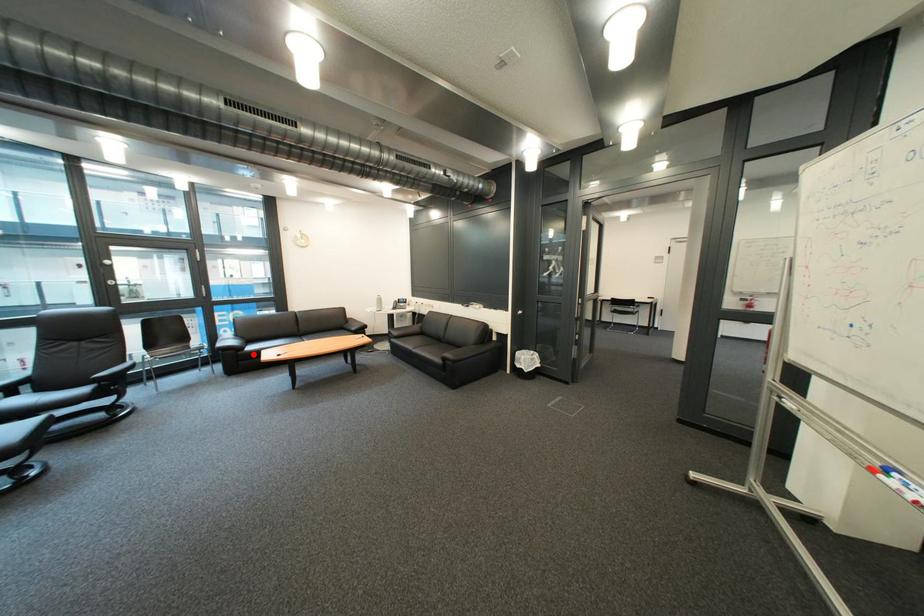
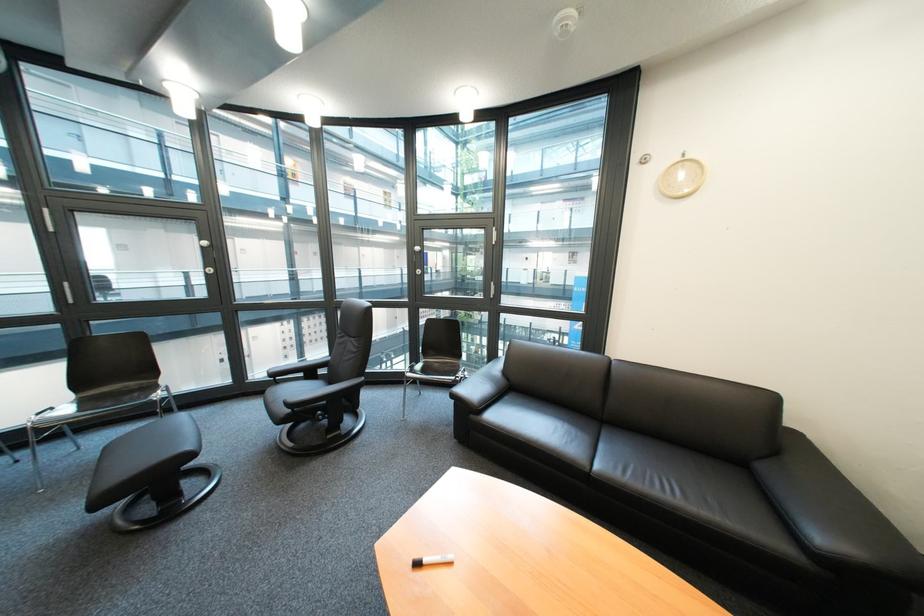
Question: I am providing you with two images of the same scene from different viewpoints. Given a red point in image1, look at the same physical point in image2. Is it:

Choices:
 (A) Closer to the viewpoint
 (B) Farther from the viewpoint

Answer: (B)